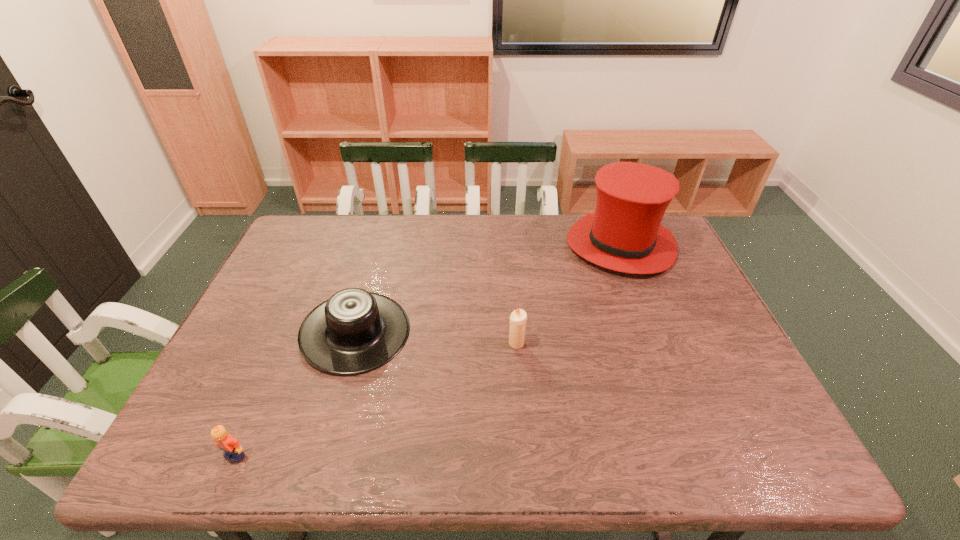
Identify the location of free space between the candle and the tallest object. This screenshot has width=960, height=540. (568, 294).

I want to click on the closest object to the left dress hat, so click(x=233, y=451).

Where is `object that is the second nearest to the nearer dress hat`? This screenshot has width=960, height=540. object that is the second nearest to the nearer dress hat is located at coordinates (518, 318).

Image resolution: width=960 pixels, height=540 pixels. Identify the location of vacant space that satisfies the following two spatial constraints: 1. on the back side of the third object from right to left; 2. on the right side of the right dress hat. (380, 245).

Locate an element on the screen. free spot that satisfies the following two spatial constraints: 1. on the back side of the second object from right to left; 2. on the right side of the right dress hat is located at coordinates (509, 245).